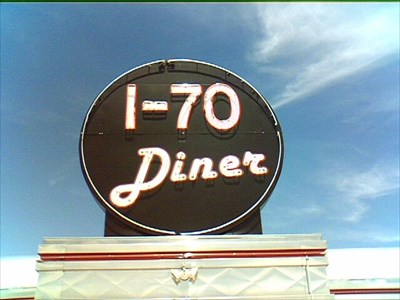
Locate an element on the screen. diamond pattern on wall is located at coordinates (91, 273), (89, 295), (71, 286), (116, 284).